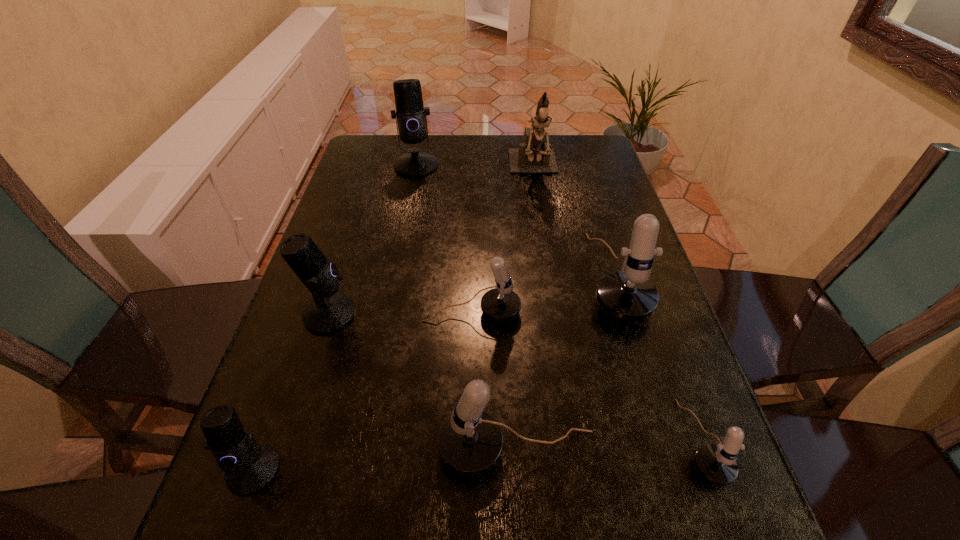
Where is `figurine`? figurine is located at coordinates pos(533,156).

This screenshot has width=960, height=540. What are the coordinates of `the third microphone from left to right` in the screenshot? It's located at (411, 115).

Identify the location of the biggest black microphone. (411, 115).

Image resolution: width=960 pixels, height=540 pixels. I want to click on the biggest white microphone, so click(628, 295).

Locate an element on the screen. The image size is (960, 540). the second nearest black microphone is located at coordinates (328, 312).

At what (x,y) coordinates should I click in order to perform the action: click on the third smallest white microphone. Please return your answer as a coordinate pair (x, y). Looking at the image, I should click on (470, 442).

This screenshot has height=540, width=960. I want to click on the third biggest white microphone, so click(501, 303).

Where is `the smallest black microphone`? The image size is (960, 540). the smallest black microphone is located at coordinates (249, 467).

The width and height of the screenshot is (960, 540). I want to click on the shortest microphone, so (717, 464).

The image size is (960, 540). I want to click on the smallest white microphone, so click(x=717, y=464).